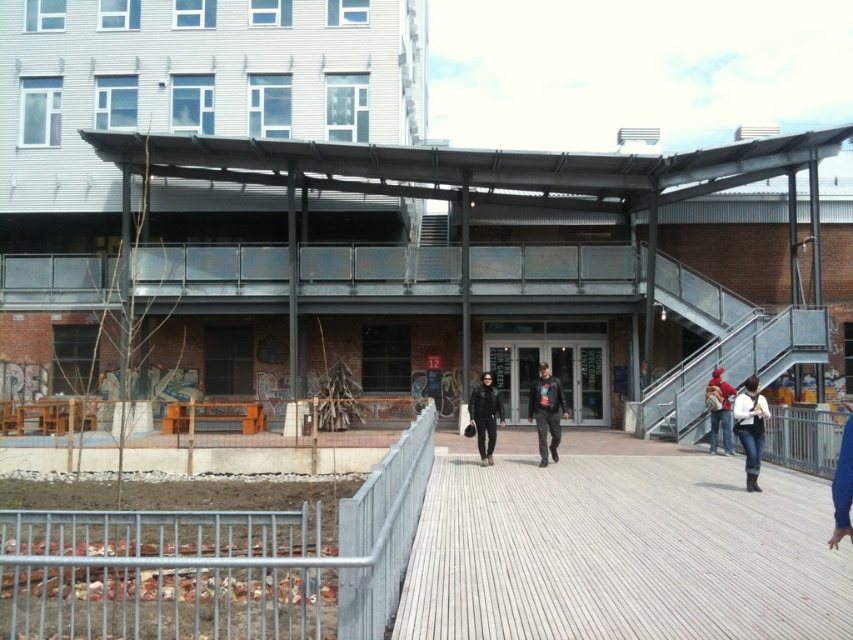
Question: Which of the following is the closest to the observer?

Choices:
 (A) (488, 417)
 (B) (595, 605)
 (C) (544, 460)

Answer: (B)

Question: In this image, where is white matte jacket at lower right located relative to leather jacket at center?

Choices:
 (A) left
 (B) right

Answer: (B)

Question: Which of the following is the closest to the observer?

Choices:
 (A) (759, 452)
 (B) (541, 570)
 (C) (547, 456)

Answer: (B)

Question: Which point appears farthest from the camera in this image?

Choices:
 (A) (744, 413)
 (B) (558, 609)
 (C) (492, 440)

Answer: (C)

Question: Does leather jacket at center appear on the right side of matte red backpack at center?

Choices:
 (A) no
 (B) yes

Answer: (A)

Question: Is the position of white matte jacket at lower right less distant than that of black leather jacket at center?

Choices:
 (A) yes
 (B) no

Answer: (A)